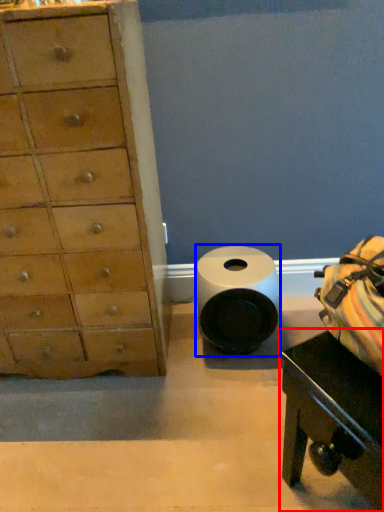
Question: Among these objects, which one is farthest to the camera, table (highlighted by a red box) or toilet paper (highlighted by a blue box)?

Choices:
 (A) table
 (B) toilet paper

Answer: (B)